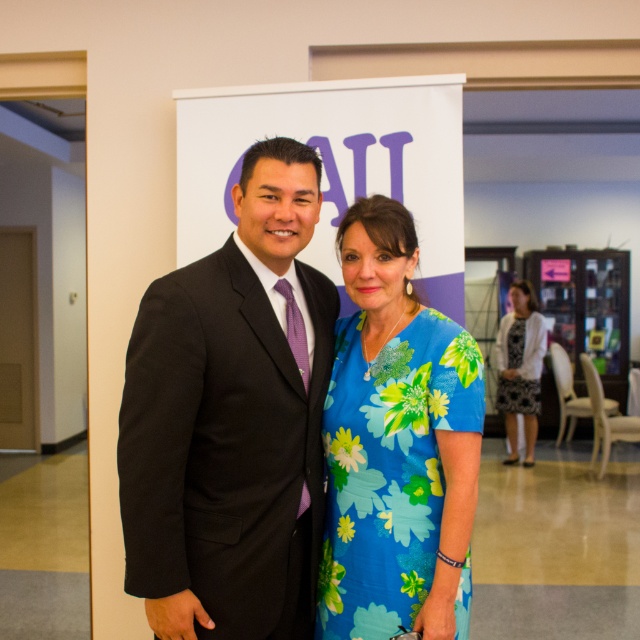
In the scene shown: Between matte black suit at center and black floral dress at right, which one is positioned higher?

Positioned higher is matte black suit at center.

Which is behind, point (232, 292) or point (522, 403)?

Positioned behind is point (522, 403).

Locate an element on the screen. matte black suit at center is located at coordinates (230, 420).

Is point (145, 467) in front of point (394, 342)?

Yes, point (145, 467) is closer to viewer.

Does matte black suit at center have a greater height compared to floral-patterned fabric dress at center?

Yes, matte black suit at center is taller than floral-patterned fabric dress at center.

Between point (220, 288) and point (342, 611), which one is positioned in front?

Point (220, 288)

The width and height of the screenshot is (640, 640). What are the coordinates of `matte black suit at center` in the screenshot? It's located at (230, 420).

Is point (413, 435) closer to camera compared to point (508, 346)?

Yes.

Is floral-patterned fabric dress at center bigger than black floral dress at right?

No, floral-patterned fabric dress at center is not bigger than black floral dress at right.

Is point (388, 570) farther from viewer compared to point (504, 323)?

That is False.

The height and width of the screenshot is (640, 640). Find the location of `floral-patterned fabric dress at center`. floral-patterned fabric dress at center is located at coordinates (388, 468).